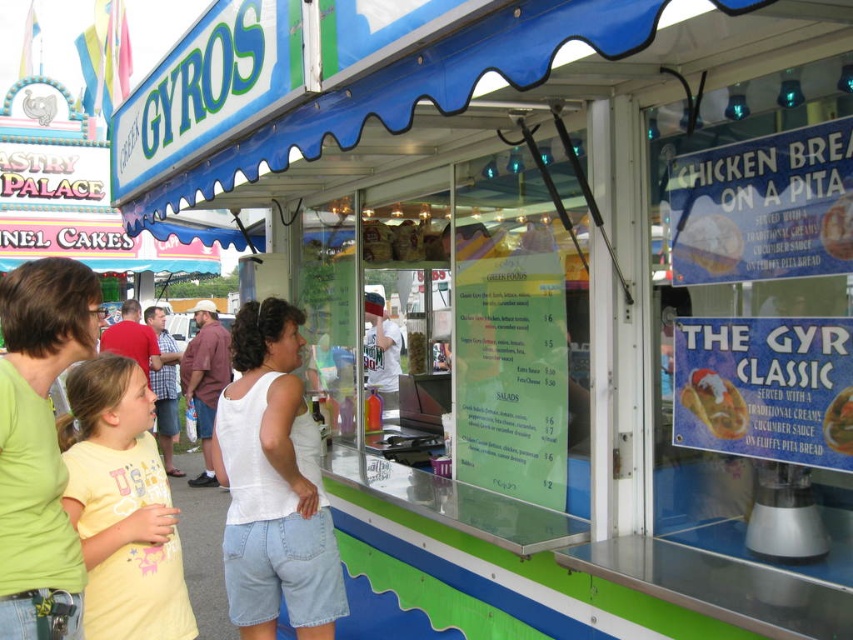
Can you confirm if white paper chicken at center is bigger than red shirt at center?

No.

Between point (701, 260) and point (169, 397), which one is positioned behind?

The point (169, 397) is more distant.

Which is behind, point (718, 232) or point (180, 353)?

Point (180, 353)

The width and height of the screenshot is (853, 640). I want to click on white paper chicken at center, so click(706, 248).

Is white cotton tank top at center to the right of smooth plastic cup at center from the viewer's perspective?

In fact, white cotton tank top at center is to the left of smooth plastic cup at center.

Can you confirm if white cotton tank top at center is bigger than smooth plastic cup at center?

Indeed, white cotton tank top at center has a larger size compared to smooth plastic cup at center.

Where is `white cotton tank top at center`? white cotton tank top at center is located at coordinates (273, 484).

Find the location of a particular element. The height and width of the screenshot is (640, 853). white cotton tank top at center is located at coordinates (273, 484).

Is green cotton shirt at left thinner than matte plastic chicken at center?

Incorrect, green cotton shirt at left's width is not less than matte plastic chicken at center's.

Between point (22, 289) and point (848, 200), which one is positioned behind?

The point (22, 289) is behind.

I want to click on green cotton shirt at left, so click(39, 444).